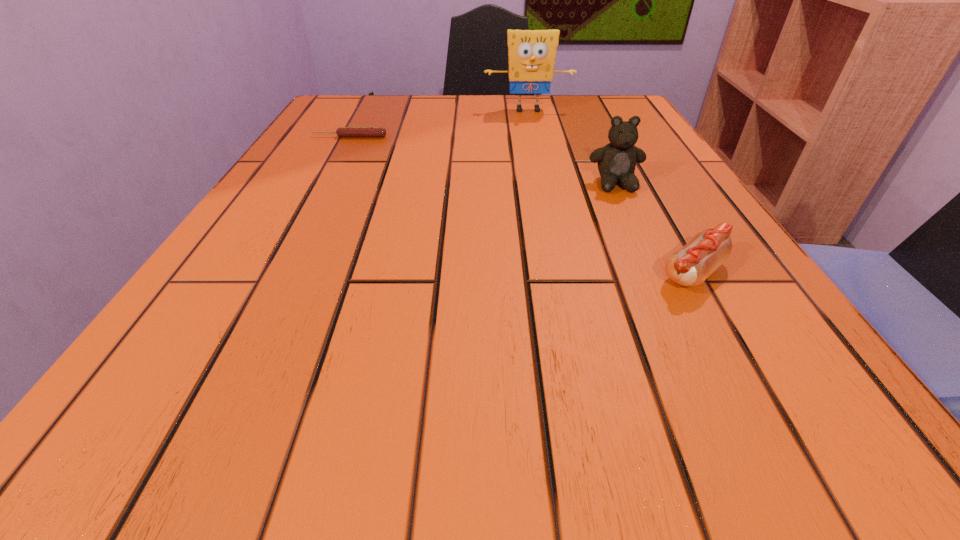
The width and height of the screenshot is (960, 540). Find the location of `the tallest object`. the tallest object is located at coordinates (531, 53).

Image resolution: width=960 pixels, height=540 pixels. I want to click on the farthest object, so click(x=531, y=53).

Locate an element on the screen. the third shortest object is located at coordinates (617, 160).

Locate an element on the screen. the third farthest object is located at coordinates (617, 160).

Identify the location of the nearer sausage. This screenshot has width=960, height=540. (690, 266).

Identify the location of the taller sausage. (690, 266).

In order to click on the leftmost object in this screenshot , I will do `click(342, 131)`.

In order to click on the shortest object in this screenshot , I will do `click(342, 131)`.

Where is `blank space located on the face of the tallest object`? blank space located on the face of the tallest object is located at coordinates (535, 143).

Locate an element on the screen. The width and height of the screenshot is (960, 540). free point located 0.150m on the face of the second nearest object is located at coordinates (645, 248).